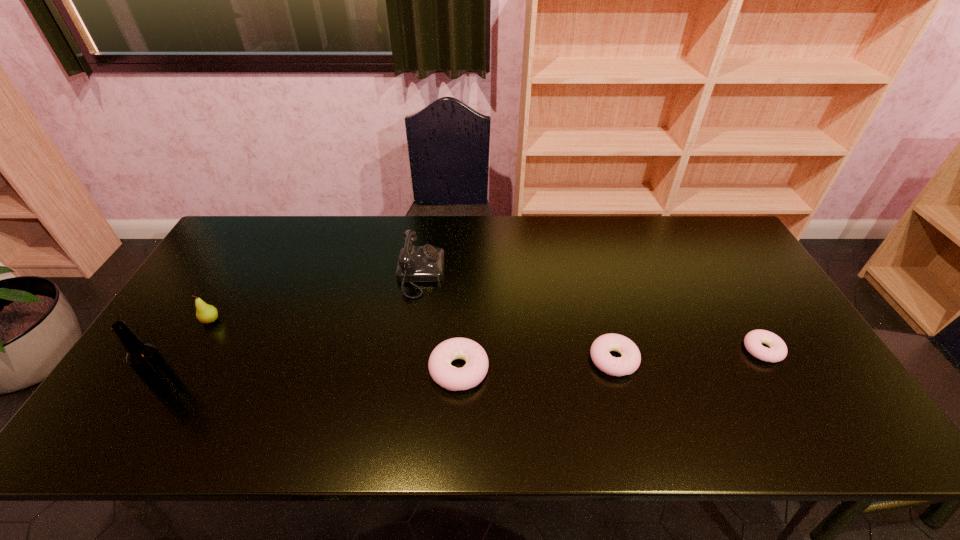
The width and height of the screenshot is (960, 540). What are the coordinates of `vacant space that's between the fifth nearest object and the tallest object` in the screenshot? It's located at (189, 354).

Identify the location of free point between the second shortest doughnut and the beer bottle. The height and width of the screenshot is (540, 960). (391, 373).

I want to click on free spot between the third shortest object and the pear, so click(x=335, y=345).

Where is `free spot between the fourth tallest object and the beer bottle`? This screenshot has height=540, width=960. free spot between the fourth tallest object and the beer bottle is located at coordinates (314, 379).

In order to click on vacant point located between the farthest object and the pear in this screenshot , I will do `click(316, 297)`.

Find the location of a particular element. The image size is (960, 540). vacant region between the pear and the shortest doughnut is located at coordinates (487, 335).

The height and width of the screenshot is (540, 960). In order to click on free spot between the shortest doughnut and the pear in this screenshot , I will do (487, 335).

Where is `object that is the fourth closest to the farthest object`? Image resolution: width=960 pixels, height=540 pixels. object that is the fourth closest to the farthest object is located at coordinates (145, 359).

Locate an element on the screen. This screenshot has width=960, height=540. object that is the closest to the telephone is located at coordinates (452, 378).

Select which doughnut appears as the closest to the third shortest object. Please provide its 2D coordinates. Your answer should be formatted as a tuple, i.e. [(x, y)], where the tuple contains the x and y coordinates of a point satisfying the conditions above.

[(629, 362)]